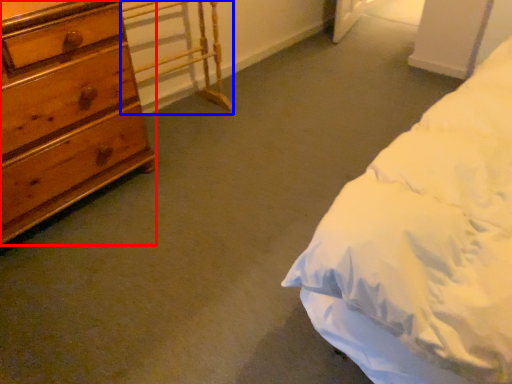
Question: Which of the following is the closest to the observer, chest of drawers (highlighted by a red box) or table (highlighted by a blue box)?

Choices:
 (A) chest of drawers
 (B) table

Answer: (A)